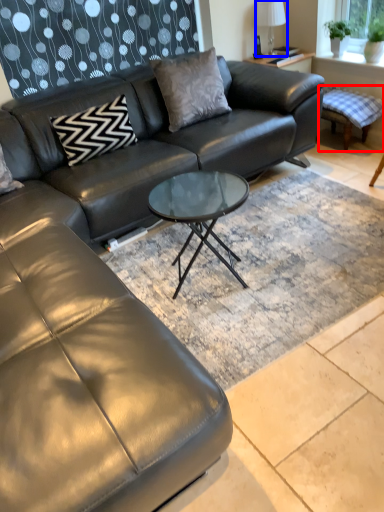
Question: Which point is further to the camera, swivel chair (highlighted by a red box) or lamp (highlighted by a blue box)?

Choices:
 (A) swivel chair
 (B) lamp

Answer: (B)